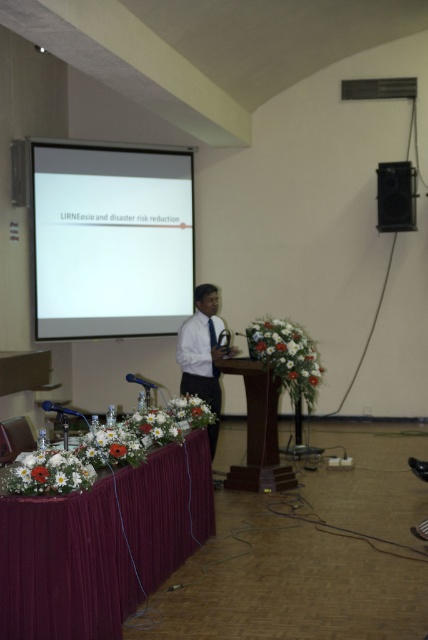
Find the location of `white shirt at center`. white shirt at center is located at coordinates (202, 348).

At what (x,y) coordinates should I click in order to perform the action: click on white shirt at center. Please return your answer as a coordinate pair (x, y). Looking at the image, I should click on (202, 348).

Is velvet burgundy tablecloth at lower left closer to camera compared to wooden at center?

Yes, it is.

Is velvet burgundy tablecloth at lower left shorter than wooden at center?

Indeed, velvet burgundy tablecloth at lower left has a lesser height compared to wooden at center.

Does point (110, 616) come in front of point (252, 417)?

That is True.

At what (x,y) coordinates should I click in order to perform the action: click on velvet burgundy tablecloth at lower left. Please return your answer as a coordinate pair (x, y). The height and width of the screenshot is (640, 428). Looking at the image, I should click on (65, 566).

Is white matte projection screen at upper left to the left of black matte speaker at upper right from the viewer's perspective?

Indeed, white matte projection screen at upper left is positioned on the left side of black matte speaker at upper right.

Does point (157, 305) come closer to viewer compared to point (385, 179)?

No, (157, 305) is behind (385, 179).

Does point (140, 292) come in front of point (392, 196)?

No, it is behind (392, 196).

This screenshot has width=428, height=640. I want to click on white matte projection screen at upper left, so click(x=110, y=241).